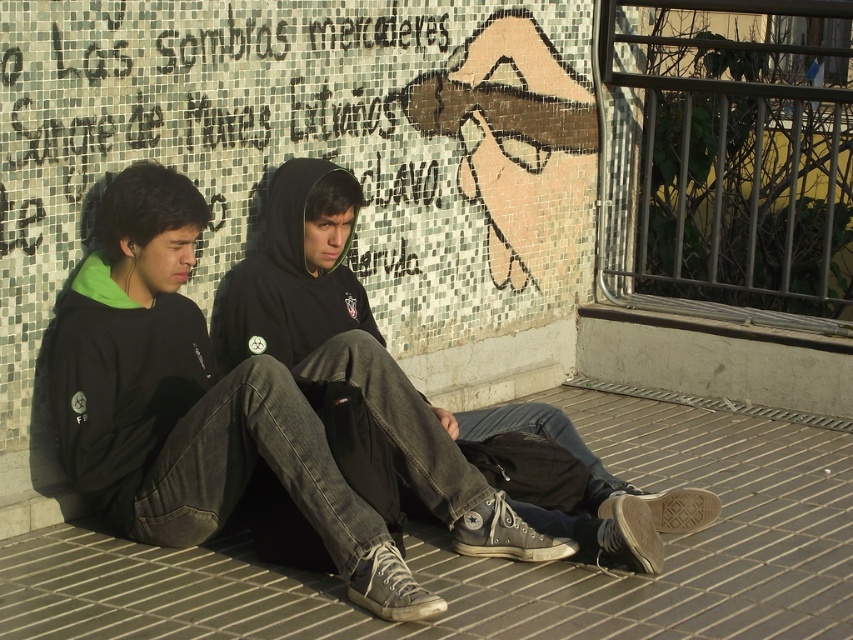
Looking at this image, which of these two, gray brick pavement at lower center or black matte hoodie at center, stands taller?

With more height is black matte hoodie at center.

In the scene shown: Is gray brick pavement at lower center taller than black matte hoodie at center?

No.

Is point (570, 612) farther from viewer compared to point (91, 294)?

No, (570, 612) is in front of (91, 294).

The width and height of the screenshot is (853, 640). Find the location of `gray brick pavement at lower center`. gray brick pavement at lower center is located at coordinates (502, 560).

Does black matte hoodie at center have a smaller size compared to dark gray hoodie at center?

Actually, black matte hoodie at center might be larger than dark gray hoodie at center.

Is point (206, 378) farther from camera compared to point (239, 348)?

No, it is not.

Is point (315, 356) behind point (329, 259)?

No.

Where is `black matte hoodie at center`? black matte hoodie at center is located at coordinates (236, 413).

Who is higher up, gray brick pavement at lower center or dark gray hoodie at center?

dark gray hoodie at center is above.

Is gray brick pavement at lower center bigger than dark gray hoodie at center?

Indeed, gray brick pavement at lower center has a larger size compared to dark gray hoodie at center.

The height and width of the screenshot is (640, 853). I want to click on gray brick pavement at lower center, so click(x=502, y=560).